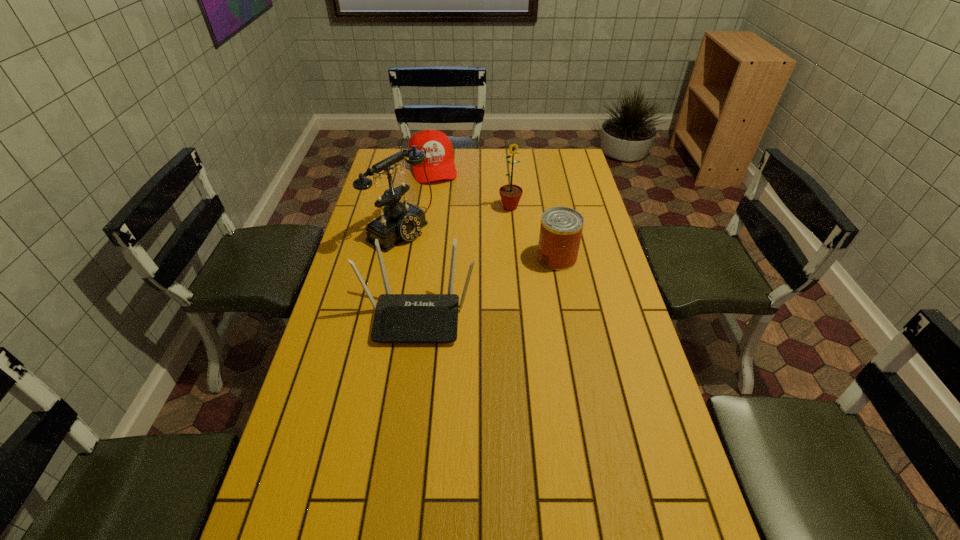
Image resolution: width=960 pixels, height=540 pixels. I want to click on free spot on the desktop that is between the nearest object and the can and is positioned on the face of the sunflower, so (510, 277).

At what (x,y) coordinates should I click in order to perform the action: click on free space on the desktop that is between the nearest object and the rightmost object and is positioned on the front panel of the farthest object. Please return your answer as a coordinate pair (x, y). The height and width of the screenshot is (540, 960). Looking at the image, I should click on (474, 292).

This screenshot has height=540, width=960. I want to click on vacant spot on the desktop that is between the nearest object and the can and is positioned on the dial of the telephone, so click(x=496, y=282).